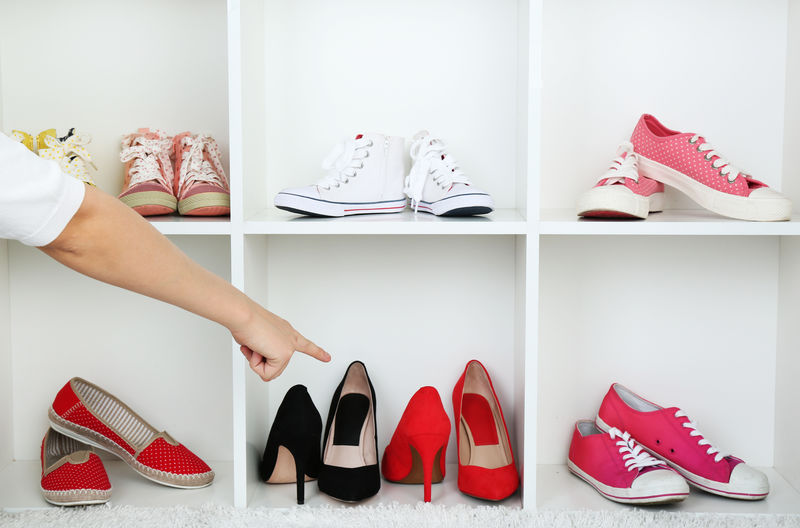
Where is `pairs of shoes in image`? This screenshot has height=528, width=800. pairs of shoes in image is located at coordinates (60, 140), (188, 156), (388, 160), (648, 174), (664, 451), (464, 439), (318, 436), (116, 436).